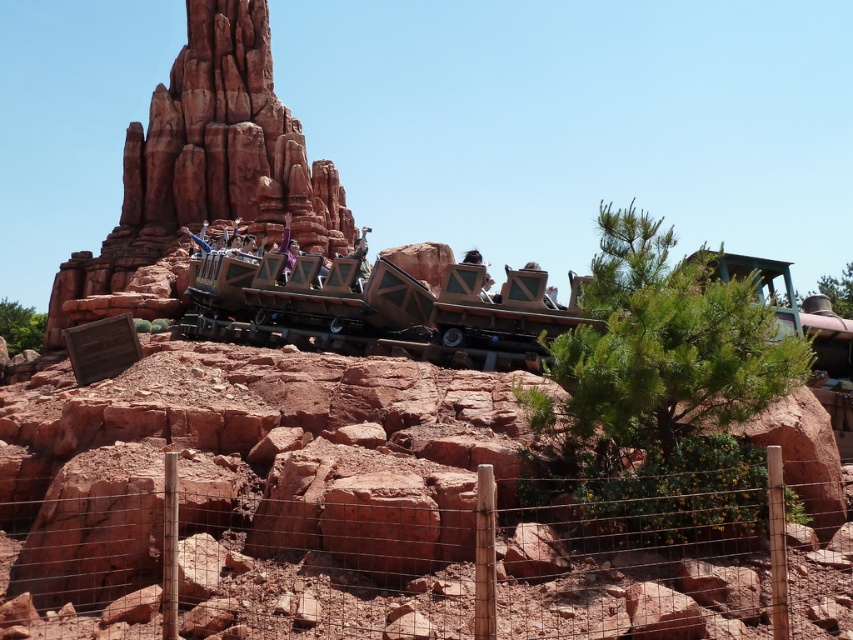
Question: Does wire mesh fence at lower center have a smaller size compared to reddish-brown stone rock formation at upper left?

Choices:
 (A) yes
 (B) no

Answer: (A)

Question: Which point is closer to the camera?

Choices:
 (A) reddish-brown stone rock formation at upper left
 (B) wire mesh fence at lower center

Answer: (B)

Question: From the image, what is the correct spatial relationship of wire mesh fence at lower center in relation to reddish-brown stone rock formation at upper left?

Choices:
 (A) right
 (B) left

Answer: (A)

Question: Does wire mesh fence at lower center appear on the left side of reddish-brown stone rock formation at upper left?

Choices:
 (A) yes
 (B) no

Answer: (B)